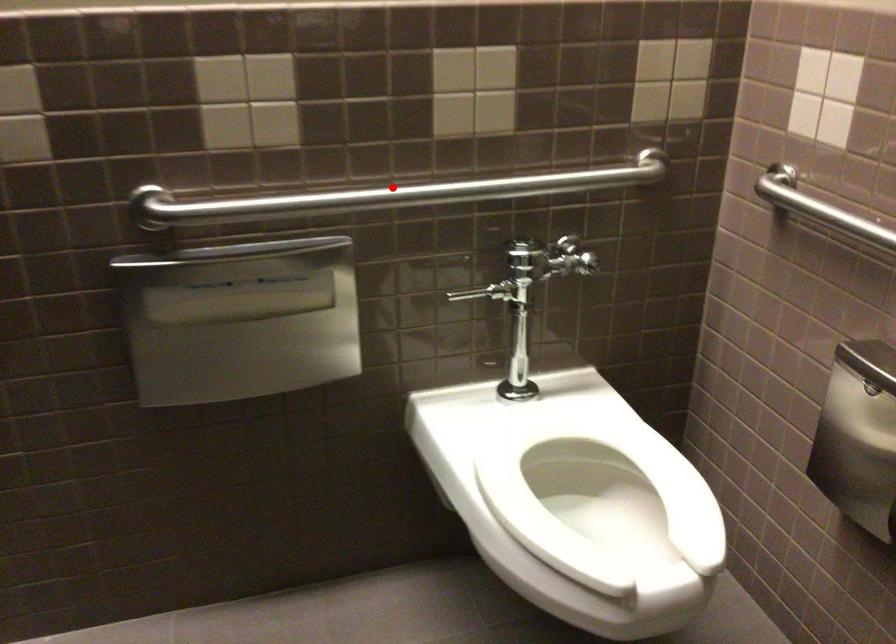
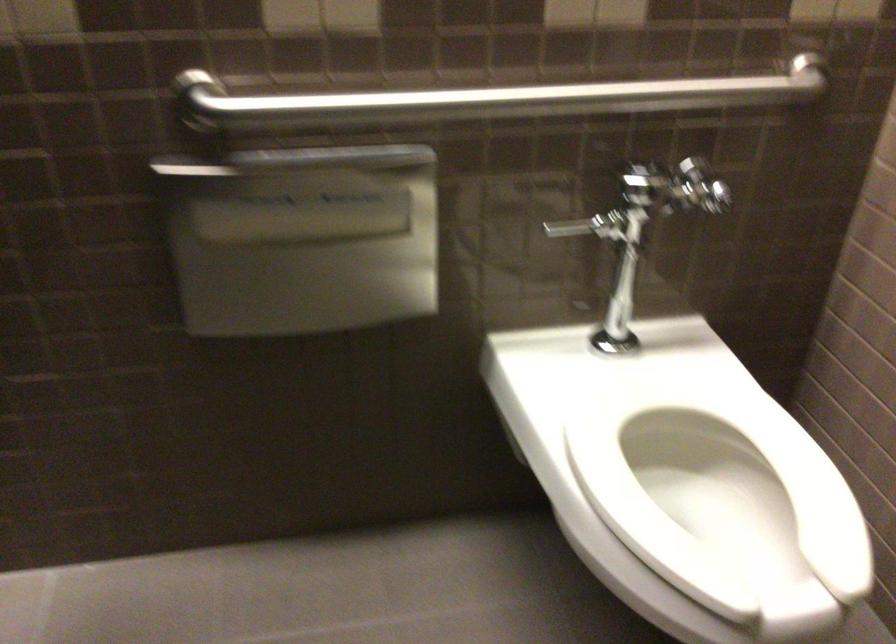
Question: A red point is marked in image1. In image2, is the corresponding 3D point closer to the camera or farther? Reply with the corresponding letter.

Choices:
 (A) The corresponding 3D point is closer.
 (B) The corresponding 3D point is farther.

Answer: (A)